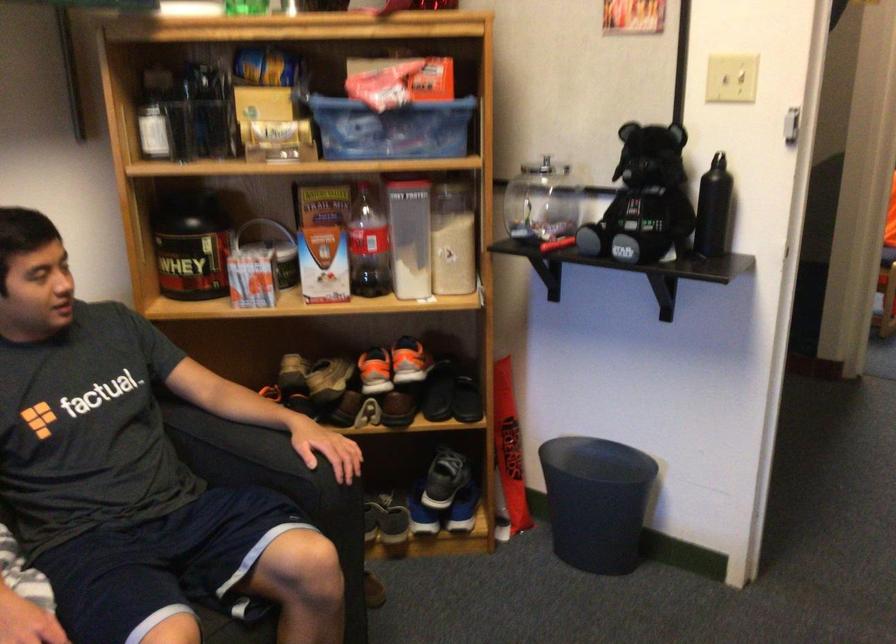
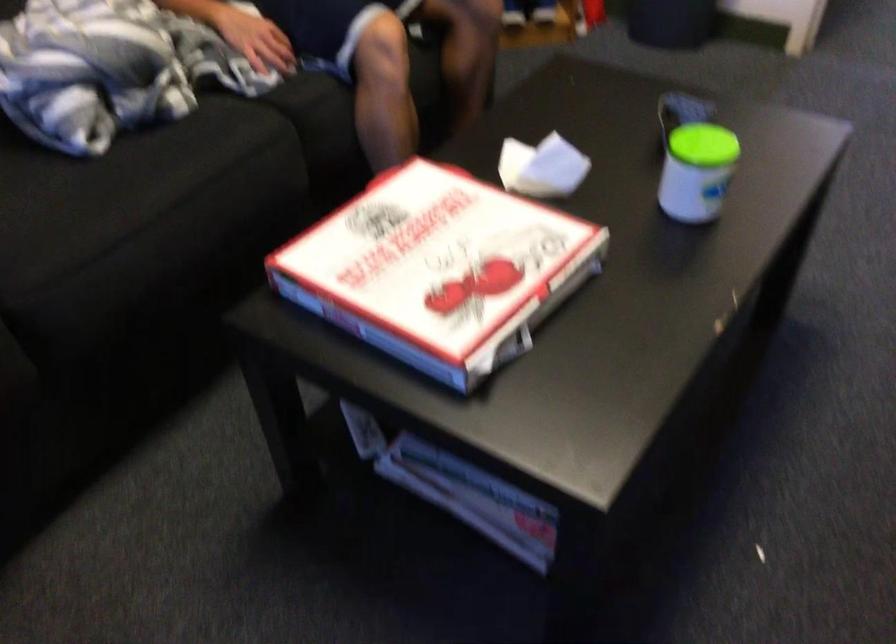
Question: The first image is from the beginning of the video and the second image is from the end. How did the camera likely rotate when shooting the video?

Choices:
 (A) Left
 (B) Right
 (C) Up
 (D) Down

Answer: (D)